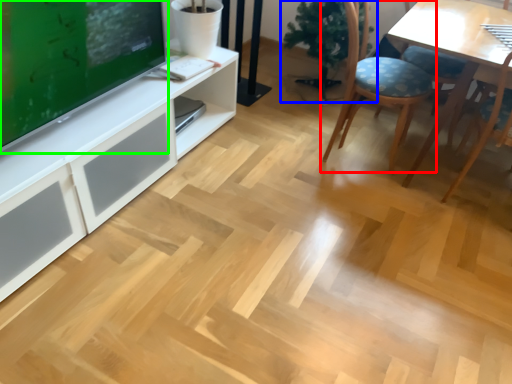
Question: Which object is positioned farthest from chair (highlighted by a red box)? Select from houseplant (highlighted by a blue box) and television (highlighted by a green box).

Choices:
 (A) houseplant
 (B) television

Answer: (B)